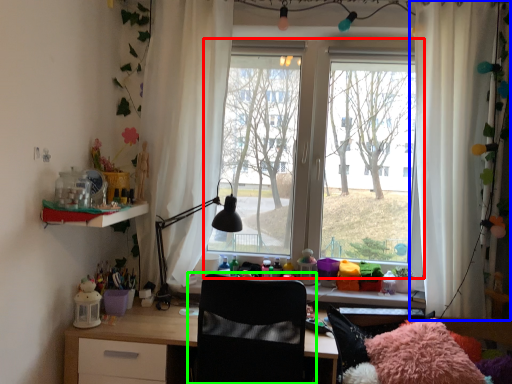
Question: Based on their relative distances, which object is farther from window (highlighted by a red box)? Choose from curtain (highlighted by a blue box) and chair (highlighted by a green box).

Choices:
 (A) curtain
 (B) chair

Answer: (B)